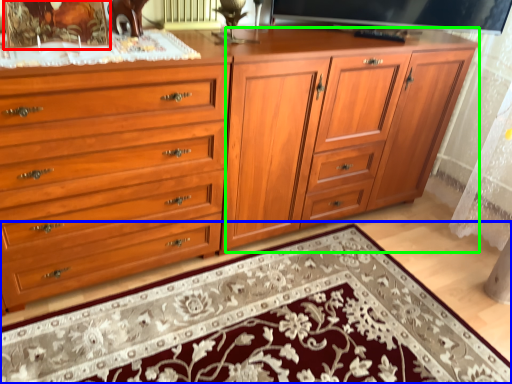
Question: Which object is the closest to the picture frame (highlighted by a red box)? Choose among these: mat (highlighted by a blue box) or tv cabinet (highlighted by a green box).

Choices:
 (A) mat
 (B) tv cabinet

Answer: (B)